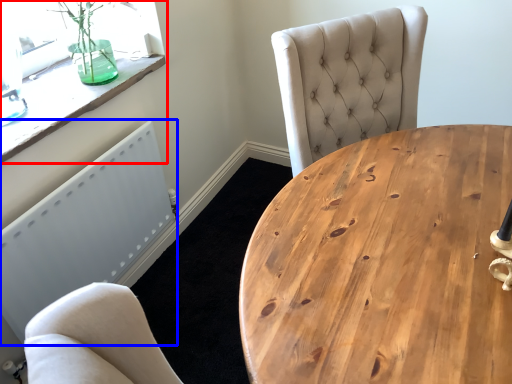
Question: Which object is closer to the camera taking this photo, window (highlighted by a red box) or radiator (highlighted by a blue box)?

Choices:
 (A) window
 (B) radiator

Answer: (B)